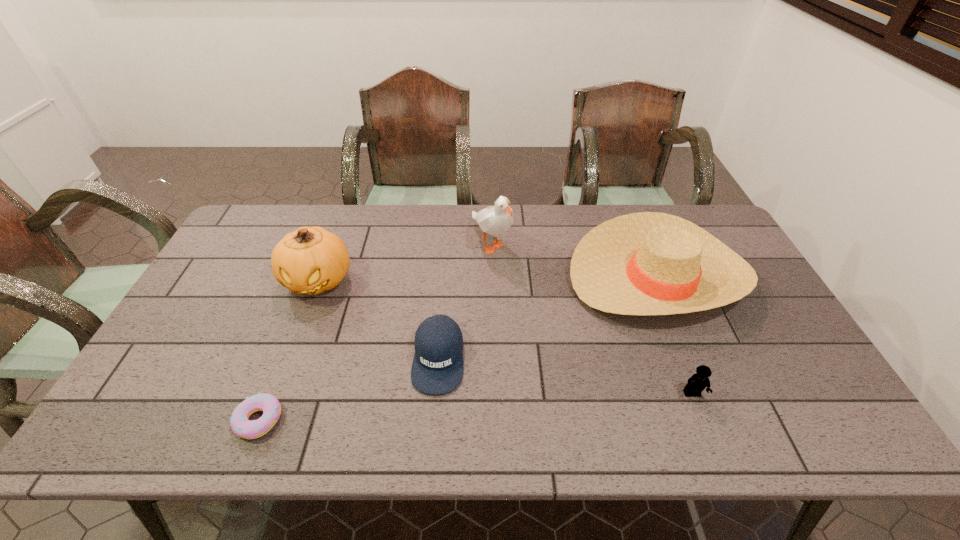
The height and width of the screenshot is (540, 960). Identify the location of blank space at the left edge of the desktop. (185, 373).

In the image, there is a desktop. Where is `vacant space at the right edge`? The image size is (960, 540). vacant space at the right edge is located at coordinates (742, 327).

In the image, there is a desktop. Where is `vacant space at the far right corner`? The height and width of the screenshot is (540, 960). vacant space at the far right corner is located at coordinates (690, 215).

Identify the location of free space between the shortest object and the pumpkin. (288, 350).

In order to click on free space that is in between the gull and the pumpkin in this screenshot , I will do `click(405, 261)`.

I want to click on vacant space that is in between the pumpkin and the Lego, so click(x=505, y=337).

Find the location of a particular element. Image resolution: width=960 pixels, height=540 pixels. free space between the third object from right to left and the shortest object is located at coordinates coord(375,332).

The width and height of the screenshot is (960, 540). What are the coordinates of `free space between the Lego and the doughnut` in the screenshot? It's located at (475, 407).

The height and width of the screenshot is (540, 960). What are the coordinates of `vacant area that lies between the pumpkin and the doughnut` in the screenshot? It's located at (288, 350).

This screenshot has width=960, height=540. I want to click on unoccupied position between the baseball cap and the Lego, so click(x=565, y=376).